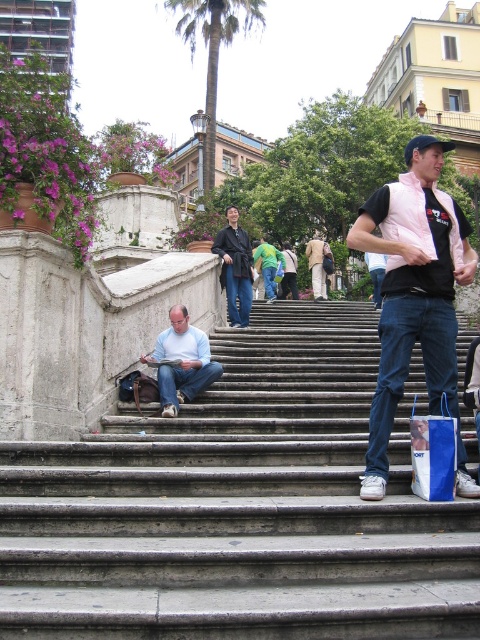
You are a tourist standing at the bottom of the staircase in the image. You want to pick up the blue paper bag at lower right without moving from your current position. Is the light blue cotton shirt at lower center blocking your direct path to the bag?

The light blue cotton shirt at lower center is located above the blue paper bag at lower right, so it is blocking the direct path to the bag. You cannot reach the blue paper bag at lower right without moving from your current position.

You are a traveler who just arrived in the city and wants to know which object is wider between the brown textured palm tree at upper center and the dark brown leather jacket at center. Can you help me determine which one is wider?

The brown textured palm tree at upper center is wider than the dark brown leather jacket at center according to the description provided.

You are a tourist trying to find your jacket in the scene. You see the brown textured palm tree at upper center and the dark brown leather jacket at center. Which object is closer to you?

The brown textured palm tree at upper center is closer to you than the dark brown leather jacket at center.